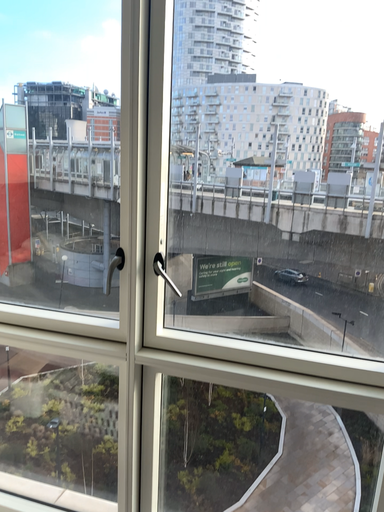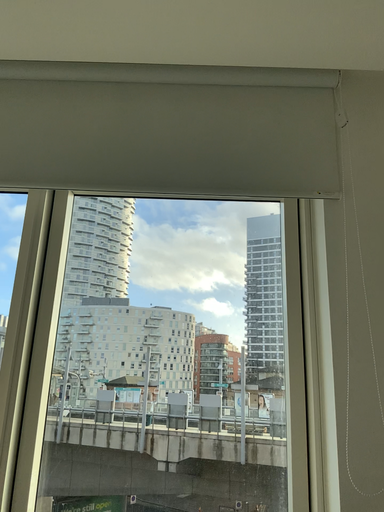
Question: How did the camera likely rotate when shooting the video?

Choices:
 (A) rotated downward
 (B) rotated upward

Answer: (B)